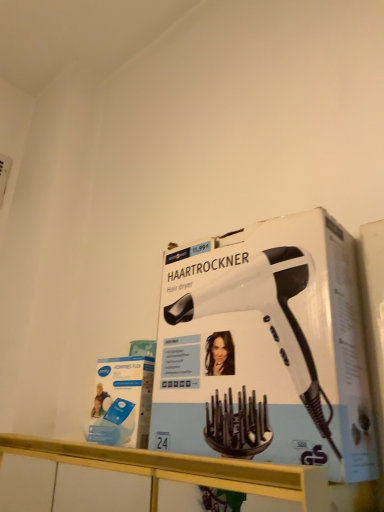
Question: From a real-world perspective, relative to white matte hair dryer at center, is white glossy counter at lower center vertically above or below?

Choices:
 (A) above
 (B) below

Answer: (B)

Question: From the image's perspective, is white glossy counter at lower center above or below white matte hair dryer at center?

Choices:
 (A) below
 (B) above

Answer: (A)

Question: Considering the positions of white glossy counter at lower center and white matte hair dryer at center in the image, is white glossy counter at lower center wider or thinner than white matte hair dryer at center?

Choices:
 (A) wide
 (B) thin

Answer: (A)

Question: From the image's perspective, is white matte hair dryer at center located above or below white glossy counter at lower center?

Choices:
 (A) above
 (B) below

Answer: (A)

Question: Is white matte hair dryer at center in front of or behind white glossy counter at lower center in the image?

Choices:
 (A) front
 (B) behind

Answer: (B)

Question: Considering the positions of point (223, 444) and point (173, 457), is point (223, 444) closer or farther from the camera than point (173, 457)?

Choices:
 (A) farther
 (B) closer

Answer: (A)

Question: Considering the relative positions of white matte hair dryer at center and white glossy counter at lower center in the image provided, is white matte hair dryer at center to the left or to the right of white glossy counter at lower center?

Choices:
 (A) left
 (B) right

Answer: (B)